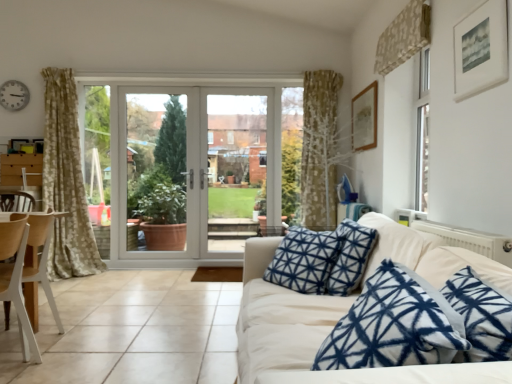
Question: Does white glass door at center have a larger size compared to white wood chair at left?

Choices:
 (A) yes
 (B) no

Answer: (B)

Question: Does white glass door at center turn towards white wood chair at left?

Choices:
 (A) no
 (B) yes

Answer: (B)

Question: Can you confirm if white glass door at center is thinner than white wood chair at left?

Choices:
 (A) yes
 (B) no

Answer: (A)

Question: From the image's perspective, is white glass door at center located above white wood chair at left?

Choices:
 (A) yes
 (B) no

Answer: (A)

Question: Can white wood chair at left be found inside white glass door at center?

Choices:
 (A) yes
 (B) no

Answer: (B)

Question: Are white glass door at center and white wood chair at left making contact?

Choices:
 (A) no
 (B) yes

Answer: (A)

Question: Considering the relative sizes of white fabric couch at center and white glass door at center in the image provided, is white fabric couch at center thinner than white glass door at center?

Choices:
 (A) no
 (B) yes

Answer: (A)

Question: Can you confirm if white fabric couch at center is shorter than white glass door at center?

Choices:
 (A) yes
 (B) no

Answer: (A)

Question: From a real-world perspective, is white fabric couch at center on white glass door at center?

Choices:
 (A) no
 (B) yes

Answer: (A)

Question: Is white fabric couch at center with white glass door at center?

Choices:
 (A) yes
 (B) no

Answer: (B)

Question: Is white fabric couch at center further to the viewer compared to white glass door at center?

Choices:
 (A) no
 (B) yes

Answer: (A)

Question: Considering the relative sizes of white fabric couch at center and white glass door at center in the image provided, is white fabric couch at center taller than white glass door at center?

Choices:
 (A) no
 (B) yes

Answer: (A)

Question: Considering the relative sizes of white plastic clock at upper left and white wood chair at lower left in the image provided, is white plastic clock at upper left thinner than white wood chair at lower left?

Choices:
 (A) no
 (B) yes

Answer: (B)